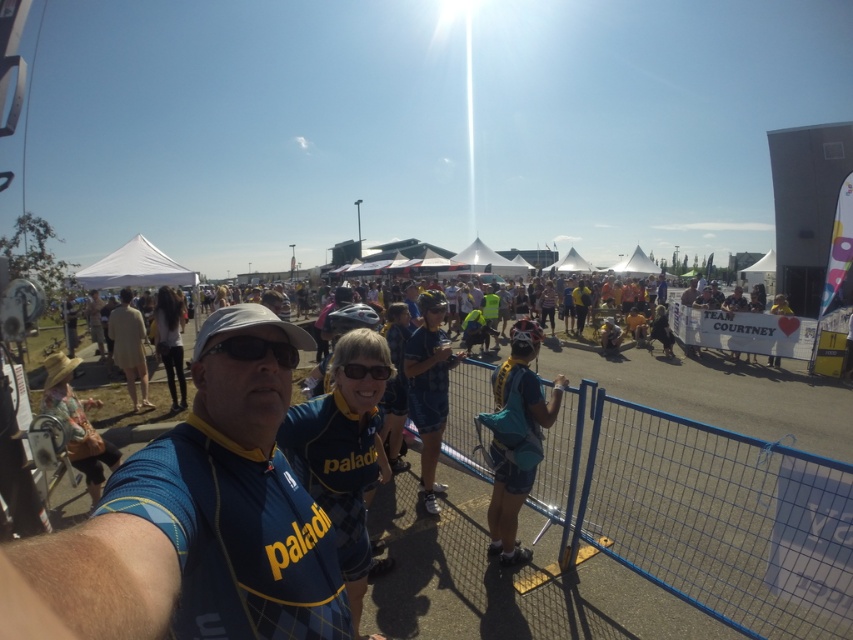
Question: Is blue fabric shirt at center smaller than matte black sunglasses at center?

Choices:
 (A) yes
 (B) no

Answer: (B)

Question: Considering the relative positions of blue jersey at center and denim jacket at lower left in the image provided, where is blue jersey at center located with respect to denim jacket at lower left?

Choices:
 (A) right
 (B) left

Answer: (A)

Question: Which object is positioned farthest from the blue jersey at center?

Choices:
 (A) matte black goggles at center
 (B) denim jacket at lower left

Answer: (B)

Question: Which object is the closest to the blue fabric shirt at center?

Choices:
 (A) blue jersey at center
 (B) blue wire mesh fence at center
 (C) teal fabric backpack at center
 (D) matte black goggles at center

Answer: (C)

Question: Does blue jersey at center appear over blue fabric shirt at center?

Choices:
 (A) yes
 (B) no

Answer: (A)

Question: Based on their relative distances, which object is nearer to the blue wire mesh fence at center?

Choices:
 (A) matte black goggles at center
 (B) blue jersey at center
 (C) denim jacket at lower left

Answer: (A)